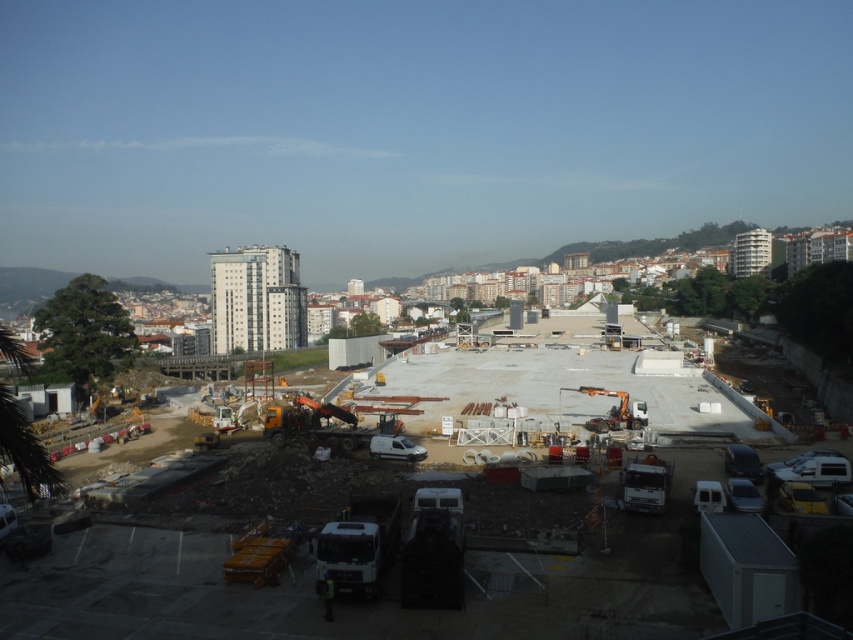
Can you confirm if white concrete construction site at center is positioned to the left of white metallic crane at center?

Correct, you'll find white concrete construction site at center to the left of white metallic crane at center.

Between white concrete construction site at center and white metallic crane at center, which one is positioned lower?

white concrete construction site at center is below.

Which is behind, point (621, 636) or point (581, 388)?

The point (581, 388) is more distant.

The width and height of the screenshot is (853, 640). I want to click on white concrete construction site at center, so click(386, 580).

Is white concrete construction site at center bigger than reflective yellow safety vest at lower center?

Correct, white concrete construction site at center is larger in size than reflective yellow safety vest at lower center.

Is point (318, 618) in front of point (329, 618)?

No.

Is point (483, 580) closer to viewer compared to point (328, 612)?

No.

Locate an element on the screen. white concrete construction site at center is located at coordinates (386, 580).

Which of these two, white metallic crane at center or reflective yellow safety vest at lower center, stands taller?

Standing taller between the two is white metallic crane at center.

Who is more distant from viewer, (630, 420) or (323, 586)?

Positioned behind is point (630, 420).

Is point (608, 396) positioned in front of point (323, 609)?

No, (608, 396) is further to viewer.

This screenshot has width=853, height=640. I want to click on white metallic crane at center, so click(x=613, y=412).